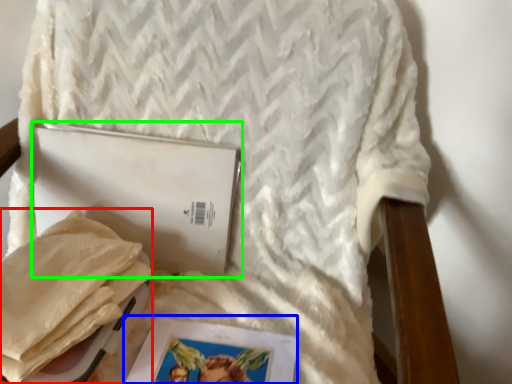
Question: Based on their relative distances, which object is nearer to material (highlighted by a red box)? Choose from magazine (highlighted by a blue box) and journal (highlighted by a green box).

Choices:
 (A) magazine
 (B) journal

Answer: (B)